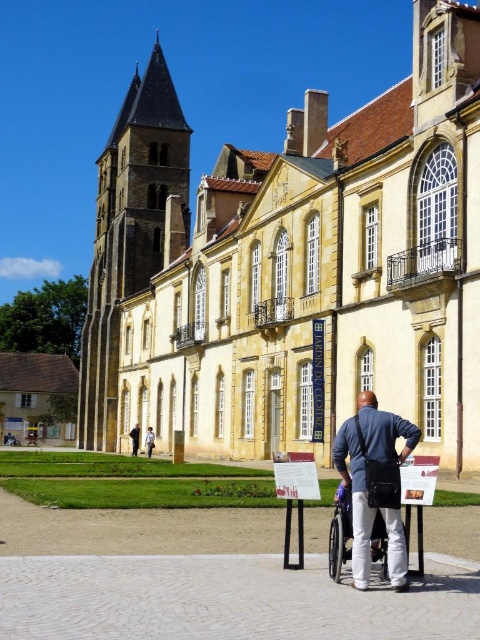
Can you confirm if brown wooden house at lower left is smaller than dark blue fabric at center?

No.

Does brown wooden house at lower left have a greater height compared to dark blue fabric at center?

Indeed, brown wooden house at lower left has a greater height compared to dark blue fabric at center.

Is point (40, 378) more distant than point (135, 448)?

That is True.

Locate an element on the screen. This screenshot has height=640, width=480. brown wooden house at lower left is located at coordinates (36, 396).

Is beige stone palace at center thinner than brown wooden house at lower left?

No.

Which of these two, beige stone palace at center or brown wooden house at lower left, stands shorter?

brown wooden house at lower left is shorter.

Is point (471, 333) closer to viewer compared to point (43, 401)?

Yes, point (471, 333) is in front of point (43, 401).

This screenshot has width=480, height=640. In order to click on beige stone palace at center in this screenshot , I will do `click(292, 266)`.

Is metallic wheelchair at center to the right of blue shirt at center from the viewer's perspective?

Indeed, metallic wheelchair at center is positioned on the right side of blue shirt at center.

Which is below, metallic wheelchair at center or blue shirt at center?

blue shirt at center is below.

The height and width of the screenshot is (640, 480). Describe the element at coordinates (339, 532) in the screenshot. I see `metallic wheelchair at center` at that location.

Where is `metallic wheelchair at center`? Image resolution: width=480 pixels, height=640 pixels. metallic wheelchair at center is located at coordinates (339, 532).